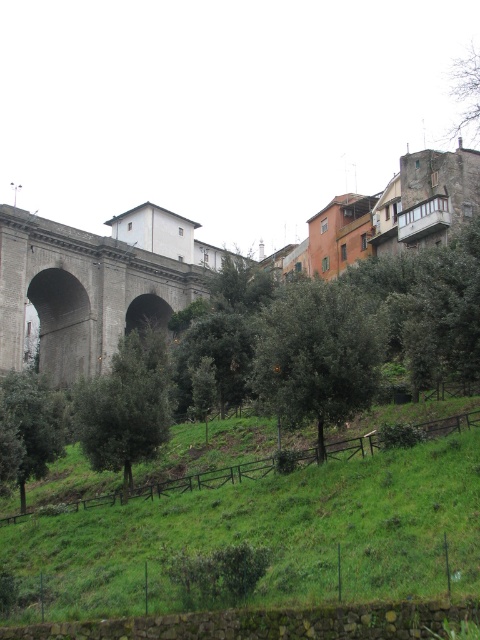
Question: Considering the relative positions of gray stone bridge at upper left and green leafy tree at lower left in the image provided, where is gray stone bridge at upper left located with respect to green leafy tree at lower left?

Choices:
 (A) above
 (B) below

Answer: (A)

Question: Can you confirm if green leafy tree at center is positioned to the left of green leafy tree at lower left?

Choices:
 (A) no
 (B) yes

Answer: (A)

Question: Which point is farther from the camera taking this photo?

Choices:
 (A) (27, 474)
 (B) (333, 544)

Answer: (A)

Question: Considering the real-world distances, which object is closest to the gray stone bridge at upper left?

Choices:
 (A) green leafy tree at center
 (B) green grassy hillside at lower center

Answer: (A)

Question: Among these objects, which one is nearest to the camera?

Choices:
 (A) green matte tree at center
 (B) green leafy tree at center
 (C) green leafy tree at lower left
 (D) green grassy hillside at lower center

Answer: (D)

Question: Is green leafy tree at center closer to camera compared to green matte tree at center?

Choices:
 (A) no
 (B) yes

Answer: (B)